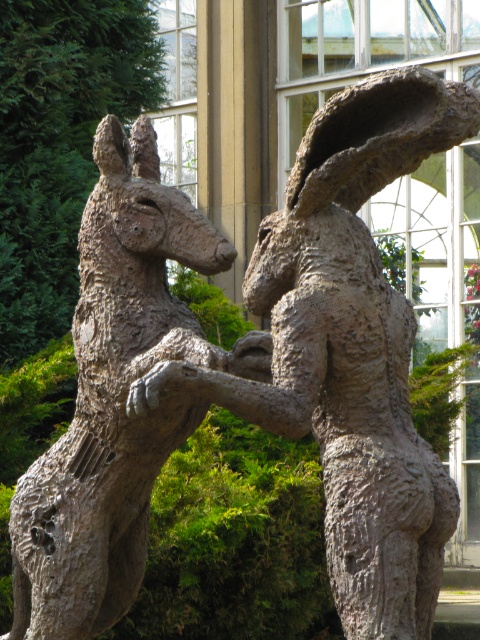
You are an art curator planning to move the rough bronze sculpture at center and the rustic stone kangaroo at center to a new exhibition space. If you want to maintain their original spatial relationship, which sculpture should be placed higher than the other?

The rough bronze sculpture at center should be placed higher than the rustic stone kangaroo at center because the rough bronze sculpture at center is located above rustic stone kangaroo at center in the original scene.

You are standing in front of the rough bronze sculpture at center. If you want to take a photo of it from the front, where should you position yourself relative to the sculpture?

The rough bronze sculpture at center is located at coordinates 0.548 on the x axis and 0.729 on the y axis. To take a photo from the front, position yourself directly in front of it along the central axis, ensuring you are aligned with its center point.